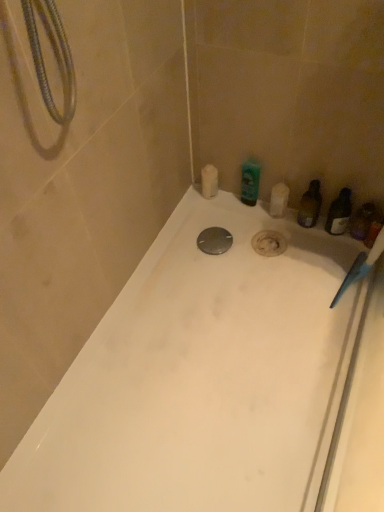
The height and width of the screenshot is (512, 384). Find the location of `vacant space positioned to the left of white matte soap bar at upper center, which appears as the first toiletry when viewed from the left`. vacant space positioned to the left of white matte soap bar at upper center, which appears as the first toiletry when viewed from the left is located at coordinates (182, 210).